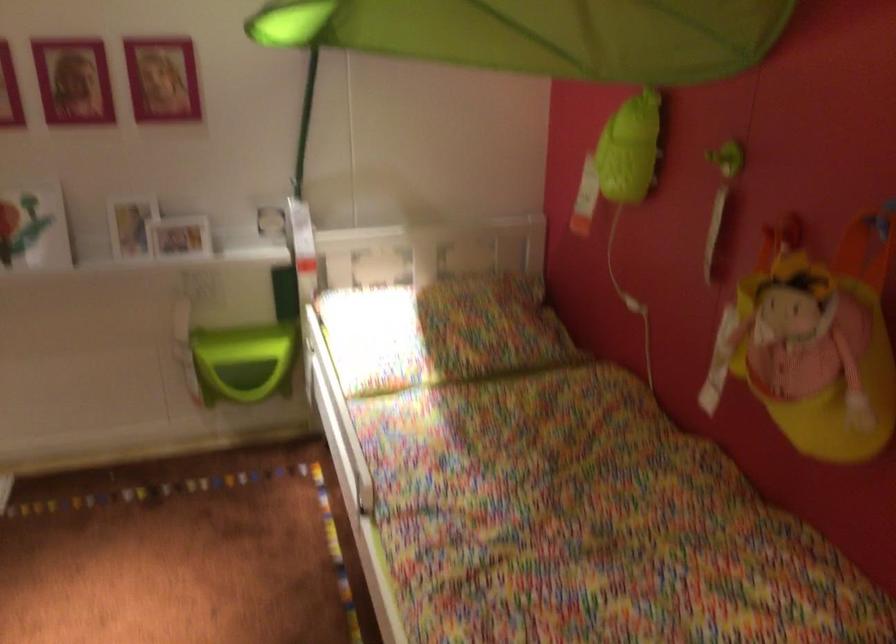
Where would you plac the green wall basket? Please return your answer as a coordinate pair (x, y).

(629, 149)